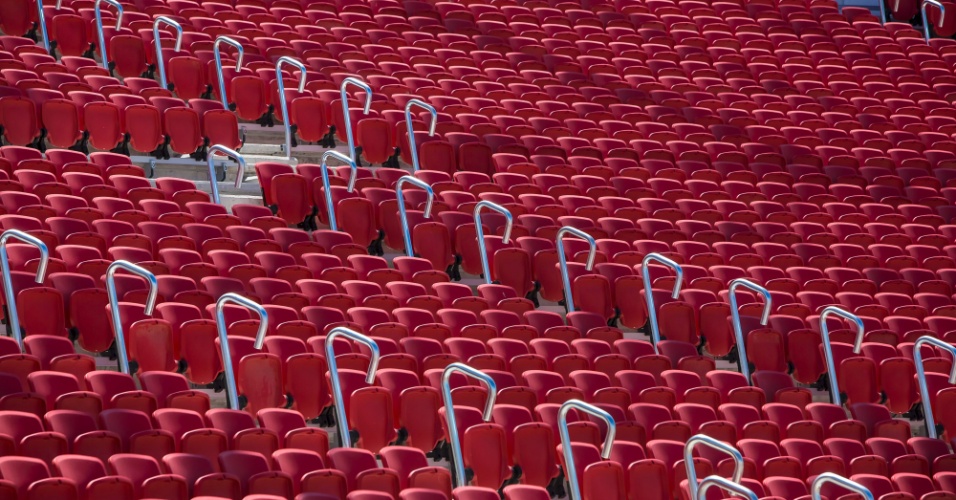
The width and height of the screenshot is (956, 500). Find the location of `stairs`. stairs is located at coordinates (231, 200), (226, 186), (201, 173), (274, 156), (258, 130), (257, 150), (303, 158).